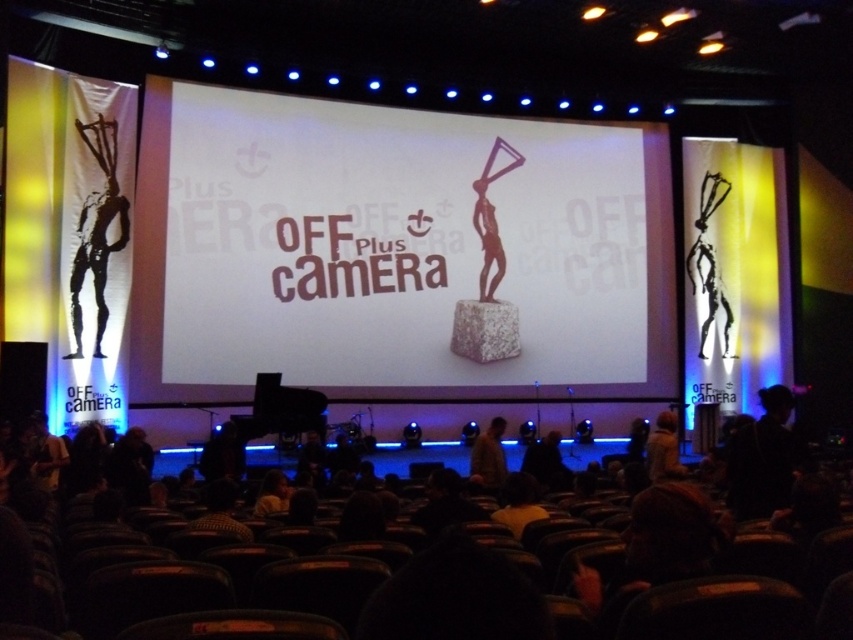
Question: Considering the real-world distances, which object is farthest from the dark brown hair at lower center?

Choices:
 (A) brown leather jacket at lower center
 (B) matte bronze statue at center

Answer: (B)

Question: Which of the following is the closest to the observer?

Choices:
 (A) fuzzy beige coat at lower right
 (B) dark brown leather jacket at center

Answer: (B)

Question: Can you confirm if matte bronze statue at center is positioned to the left of brown leather jacket at lower center?

Choices:
 (A) no
 (B) yes

Answer: (A)

Question: Which point is farther from the camera taking this photo?

Choices:
 (A) (94, 253)
 (B) (509, 477)
 (C) (679, 474)

Answer: (A)

Question: Is matte bronze statue at center above brown leather jacket at lower center?

Choices:
 (A) yes
 (B) no

Answer: (A)

Question: Does silvery metallic statue at left appear on the right side of brown leather jacket at lower center?

Choices:
 (A) yes
 (B) no

Answer: (B)